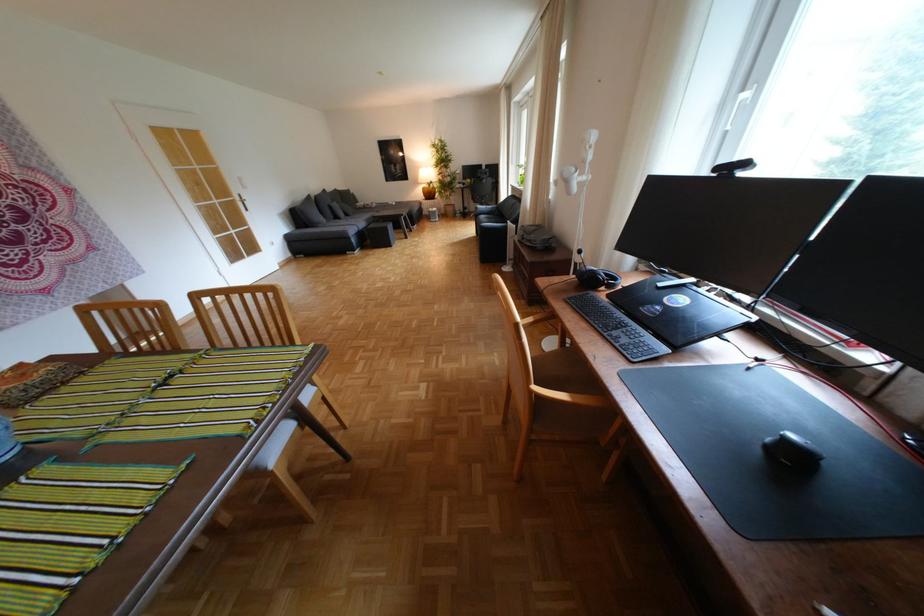
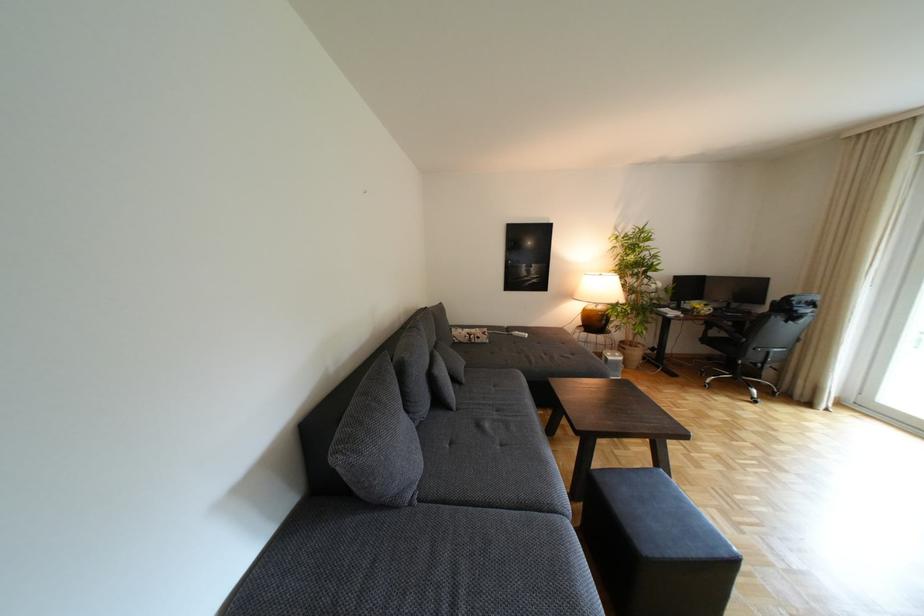
In the second image, find the point that corresponds to (x=359, y=215) in the first image.

(468, 379)